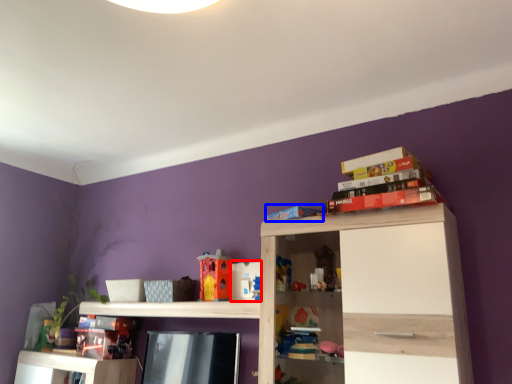
Question: Among these objects, which one is nearest to the camera, toy (highlighted by a red box) or book (highlighted by a blue box)?

Choices:
 (A) toy
 (B) book

Answer: (B)